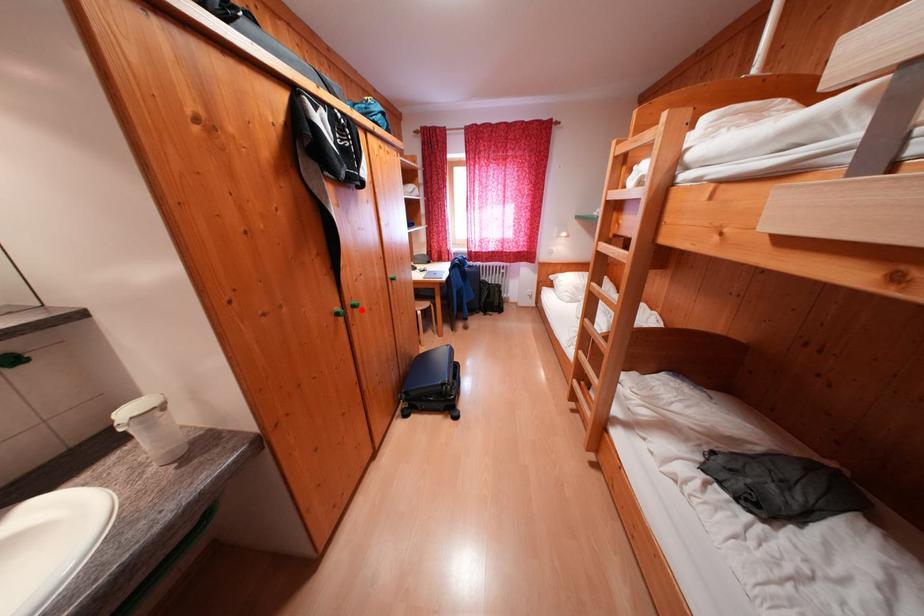
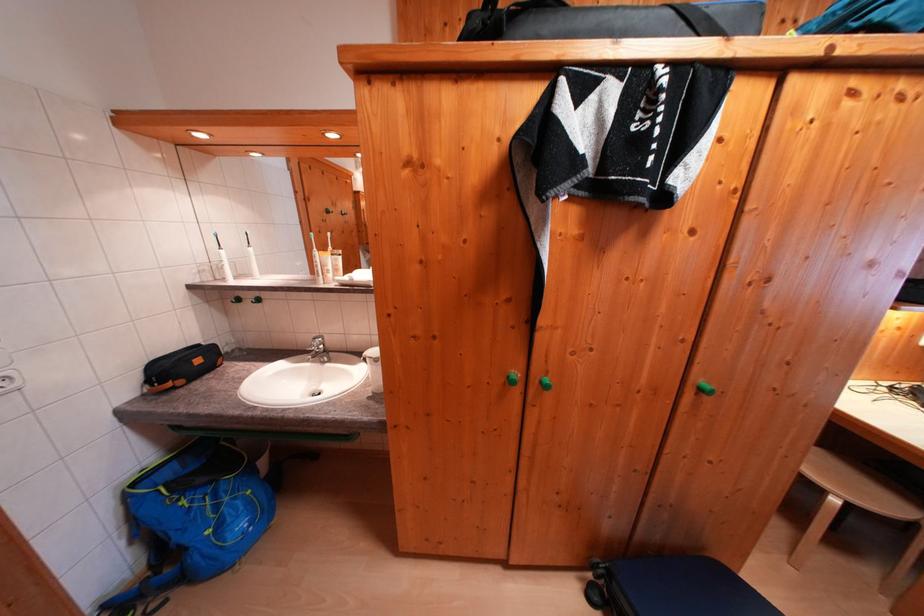
Where in the second image is the point corresponding to the highlighted location from the first image?

(550, 387)